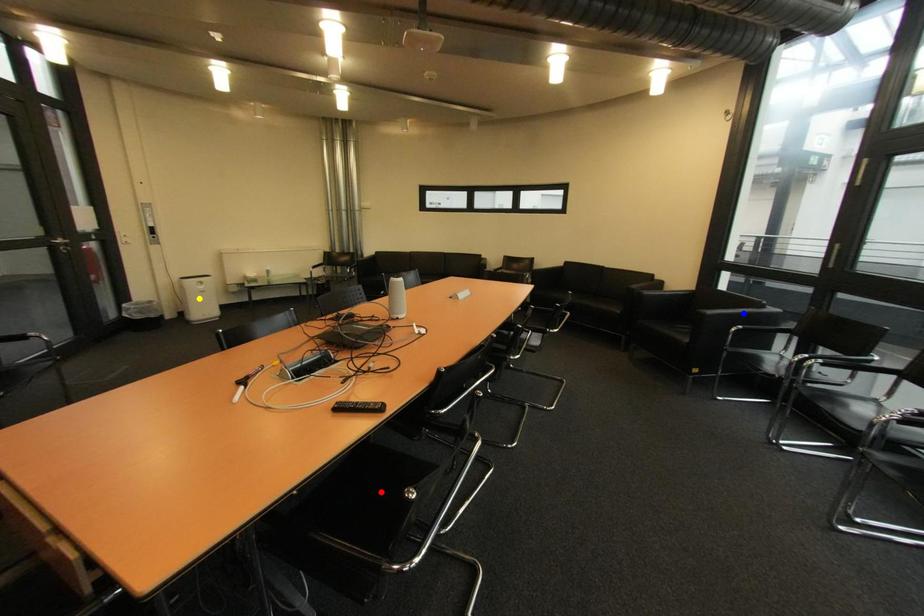
Order these from nearest to farthest:
red point | blue point | yellow point

yellow point
blue point
red point